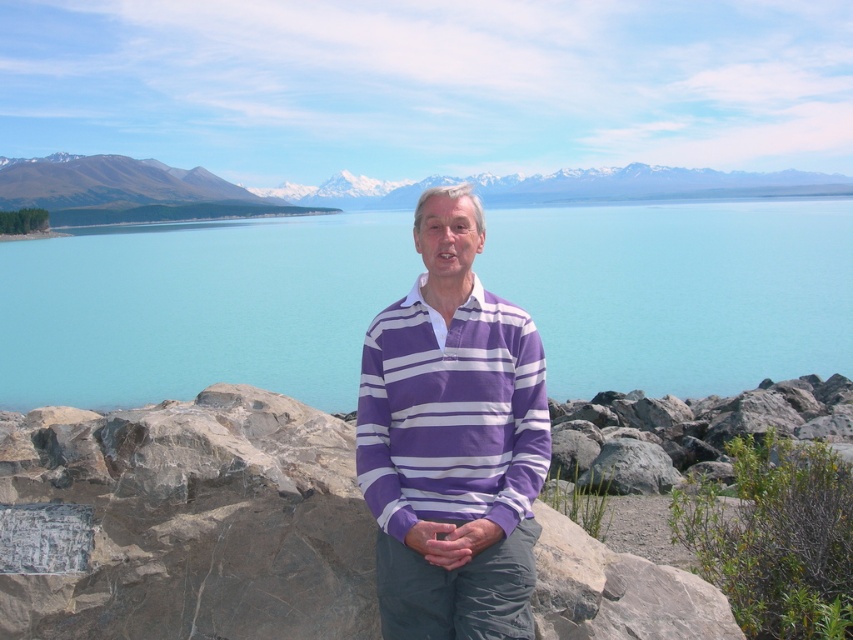
You are a photographer trying to capture the scenic view behind the person wearing the purple striped sweater at center. To ensure the mountains and lake are in focus, you need to adjust your camera settings. Since the sweater is at point [451,440], which is closer to the camera than the mountains, what adjustment should you make?

Since the purple striped sweater at center is closer to the camera than the mountains, you should increase the depth of field to ensure both the foreground and background are in focus.

You are a photographer standing at the edge of the rocky terrain where the person is standing. You want to take a photo that includes both the turquoise water at center and the snow capped mountains in the background. Since the camera has a limited depth of field, you can only focus on one object at a time. Which object should you focus on to ensure the other remains somewhat in focus?

You should focus on the turquoise water at center because it is closer to the camera than the snow capped mountains. By focusing on the closer object, the background mountains will still be somewhat in focus while the foreground water remains sharp.